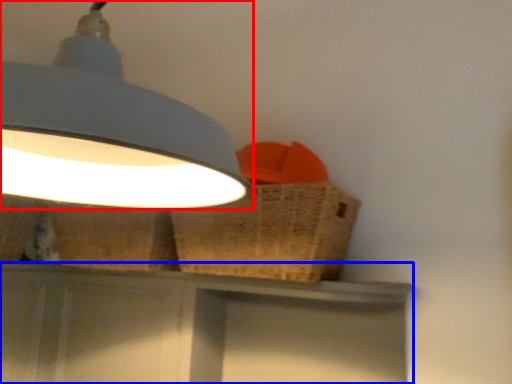
Question: Which of the following is the closest to the observer, lamp (highlighted by a red box) or vanity (highlighted by a blue box)?

Choices:
 (A) lamp
 (B) vanity

Answer: (A)